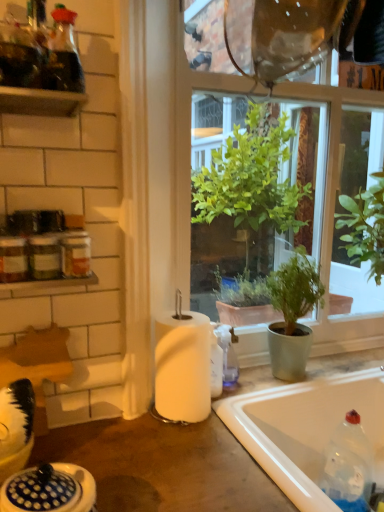
Identify the location of vacant area that lies between white matte paper towel at center and white glossy sink at lower left. (146, 458).